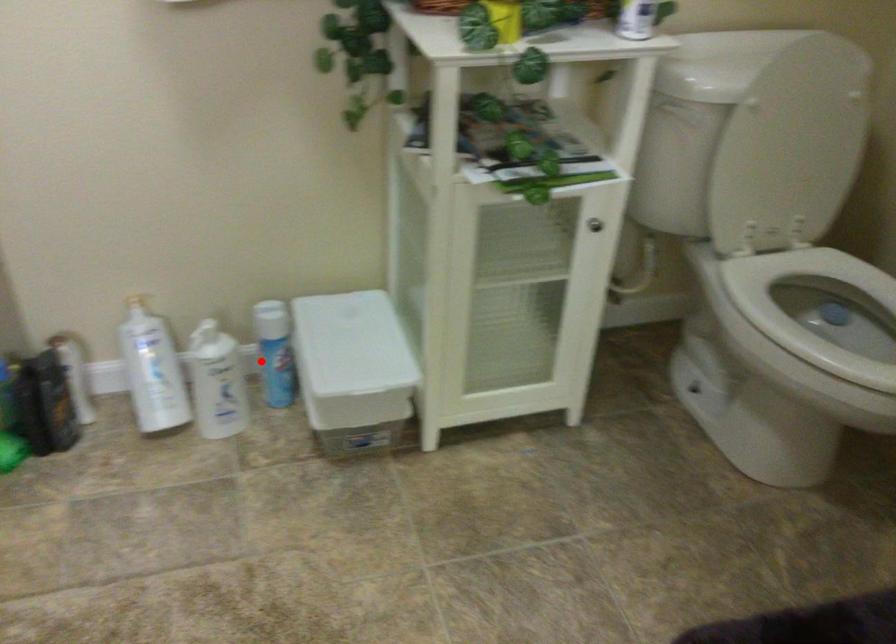
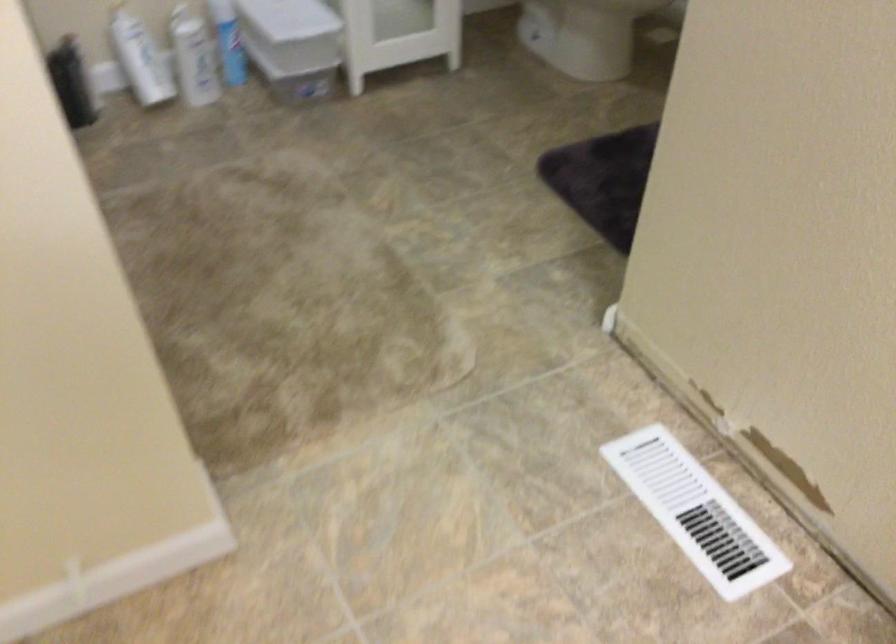
Locate, in the second image, the point that corresponds to the highlighted location in the first image.

(228, 41)